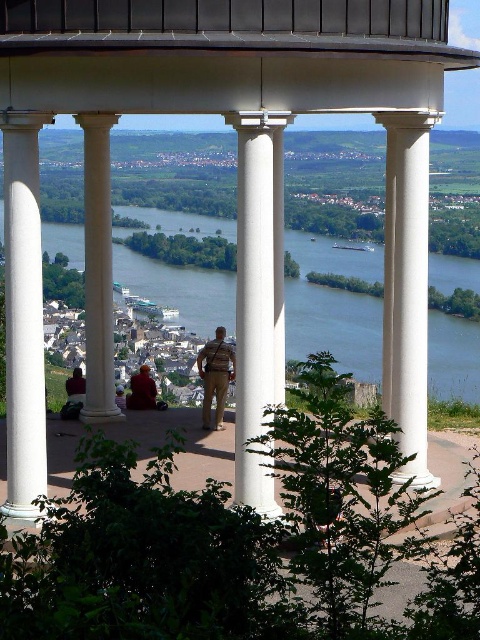
You are standing at the entrance of the classical structure and want to take a photo of the white smooth column at center and the matte black jacket at lower left. Which object should you adjust your camera focus on first to ensure both are in the frame?

Since the white smooth column at center is closer to the viewer than the matte black jacket at lower left, you should focus on the matte black jacket at lower left first to ensure both are in focus as the column is closer and might require adjusting the focal plane.

You are standing at point (97, 113) and want to walk to the other side of the colonnade. How far will you have to walk?

You will have to walk 32.39 meters to reach the other side of the colonnade from point (97, 113).